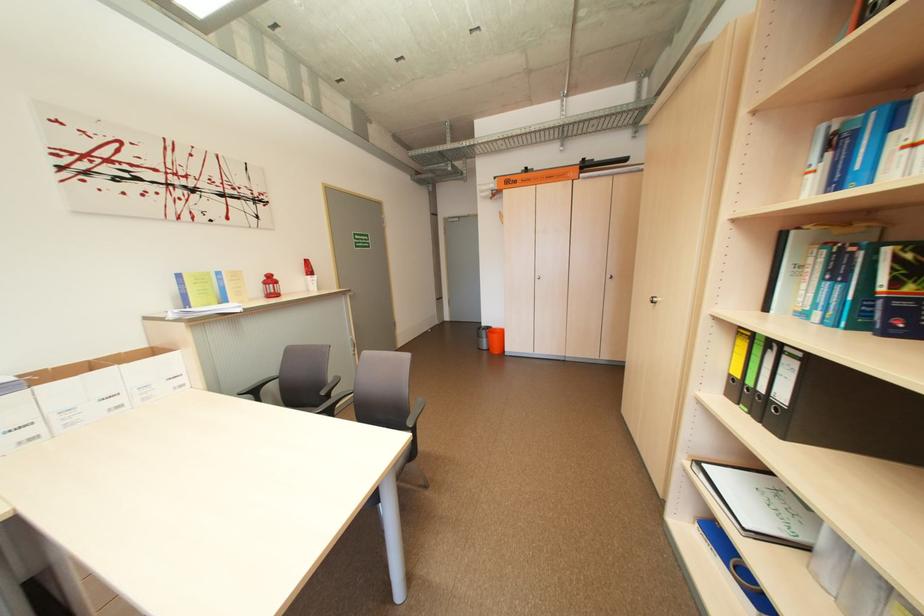
Where is `black chair armrest`? The height and width of the screenshot is (616, 924). black chair armrest is located at coordinates (415, 413).